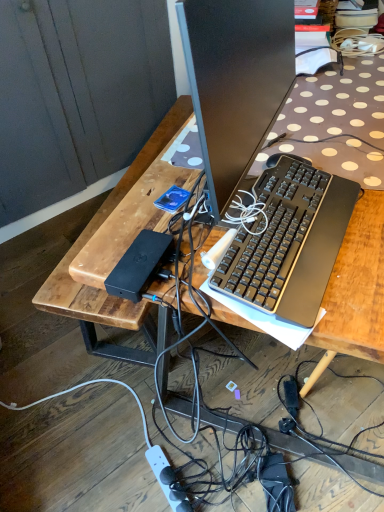
Identify the location of vacant location behind white plastic power outlet at lower center. The height and width of the screenshot is (512, 384). (x=160, y=430).